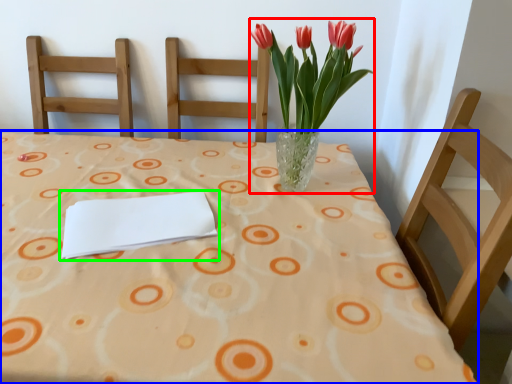
Question: Estimate the real-world distances between objects in this image. Which object is closer to floral arrangement (highlighted by a red box), table (highlighted by a blue box) or journal (highlighted by a green box)?

Choices:
 (A) table
 (B) journal

Answer: (A)